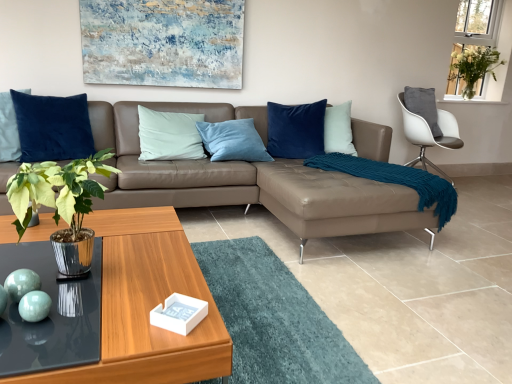
Locate an element on the screen. This screenshot has width=512, height=384. vacant area that lies to the right of shiny metallic plant at center-left is located at coordinates (156, 283).